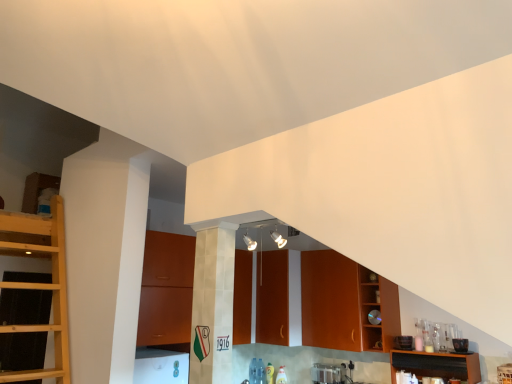
Question: Does brown wooden shelf at lower right touch satin silver toaster at lower center?

Choices:
 (A) yes
 (B) no

Answer: (B)

Question: Is brown wooden shelf at lower right not close to satin silver toaster at lower center?

Choices:
 (A) no
 (B) yes

Answer: (A)

Question: Is brown wooden shelf at lower right in front of satin silver toaster at lower center?

Choices:
 (A) yes
 (B) no

Answer: (A)

Question: Can you confirm if brown wooden shelf at lower right is shorter than satin silver toaster at lower center?

Choices:
 (A) no
 (B) yes

Answer: (A)

Question: Is brown wooden shelf at lower right wider than satin silver toaster at lower center?

Choices:
 (A) no
 (B) yes

Answer: (A)

Question: Is brown wooden shelf at lower right positioned beyond the bounds of satin silver toaster at lower center?

Choices:
 (A) yes
 (B) no

Answer: (A)

Question: Are brown wooden shelf at lower right and matte wood cabinetry at center, positioned as the first cabinetry in left-to-right order, beside each other?

Choices:
 (A) no
 (B) yes

Answer: (A)

Question: From the image's perspective, is brown wooden shelf at lower right on top of matte wood cabinetry at center, positioned as the first cabinetry in left-to-right order?

Choices:
 (A) no
 (B) yes

Answer: (A)

Question: Is brown wooden shelf at lower right to the left of matte wood cabinetry at center, positioned as the first cabinetry in left-to-right order, from the viewer's perspective?

Choices:
 (A) yes
 (B) no

Answer: (B)

Question: Is brown wooden shelf at lower right to the right of matte wood cabinetry at center, positioned as the first cabinetry in left-to-right order, from the viewer's perspective?

Choices:
 (A) no
 (B) yes

Answer: (B)

Question: Can you confirm if brown wooden shelf at lower right is taller than matte wood cabinetry at center, positioned as the first cabinetry in left-to-right order?

Choices:
 (A) yes
 (B) no

Answer: (B)

Question: Does brown wooden shelf at lower right have a lesser width compared to matte wood cabinetry at center, positioned as the first cabinetry in left-to-right order?

Choices:
 (A) no
 (B) yes

Answer: (B)

Question: Does satin silver toaster at lower center have a greater height compared to matte wood cabinetry at center, which ranks as the fourth cabinetry in right-to-left order?

Choices:
 (A) no
 (B) yes

Answer: (A)